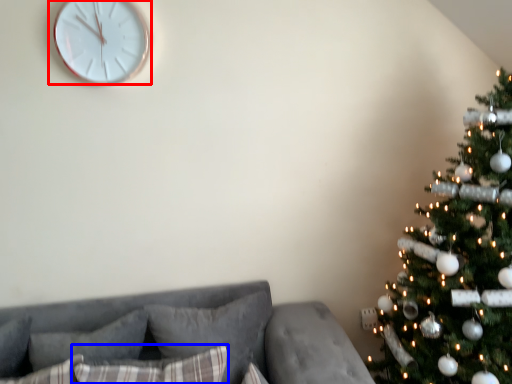
Question: Among these objects, which one is farthest to the camera, wall clock (highlighted by a red box) or pillow (highlighted by a blue box)?

Choices:
 (A) wall clock
 (B) pillow

Answer: (A)